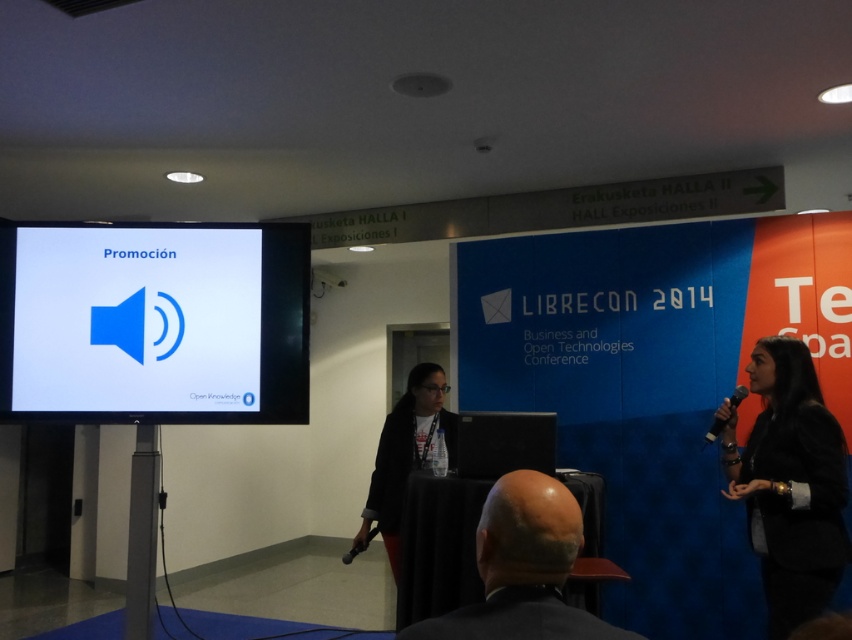
Question: Can you confirm if white glossy projector screen at left is positioned above bald head at lower center?

Choices:
 (A) no
 (B) yes

Answer: (B)

Question: Can you confirm if white glossy projector screen at left is positioned below bald head at lower center?

Choices:
 (A) no
 (B) yes

Answer: (A)

Question: Is white glossy projector screen at left below black leather jacket at right?

Choices:
 (A) no
 (B) yes

Answer: (A)

Question: Which object appears closest to the camera in this image?

Choices:
 (A) bald head at lower center
 (B) white glossy projector screen at left

Answer: (A)

Question: Which point is farther to the camera?

Choices:
 (A) (33, 369)
 (B) (494, 541)
 (C) (737, 483)

Answer: (A)

Question: Which point is closer to the camera taking this photo?

Choices:
 (A) (809, 372)
 (B) (485, 557)

Answer: (B)